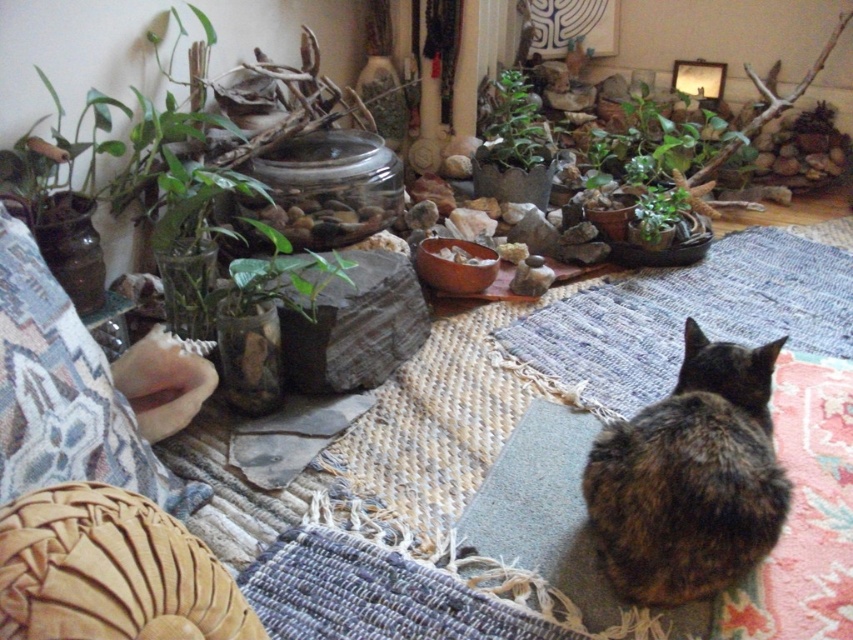
Question: Is tortoiseshell fur cat at center to the right of green leafy plant at center from the viewer's perspective?

Choices:
 (A) yes
 (B) no

Answer: (B)

Question: Is tortoiseshell fur cat at center wider than green glossy plant at upper center?

Choices:
 (A) yes
 (B) no

Answer: (A)

Question: Which point is closer to the camera?

Choices:
 (A) green leafy plant at center
 (B) woven fabric pillow at lower left
 (C) green glossy plant at upper center

Answer: (B)

Question: Which of the following is the farthest from the observer?

Choices:
 (A) woven fabric pillow at lower left
 (B) green glossy plant at upper center
 (C) tortoiseshell fur cat at center

Answer: (B)

Question: Is blue woven mat at lower right to the right of green leafy plant at center from the viewer's perspective?

Choices:
 (A) yes
 (B) no

Answer: (A)

Question: Which point is closer to the camera taking this photo?

Choices:
 (A) (67, 467)
 (B) (657, 234)

Answer: (A)